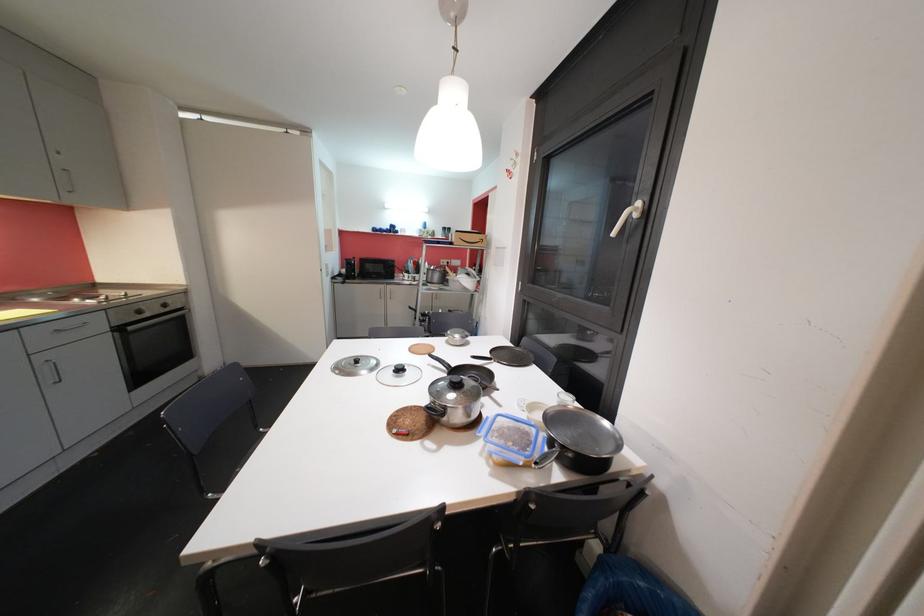
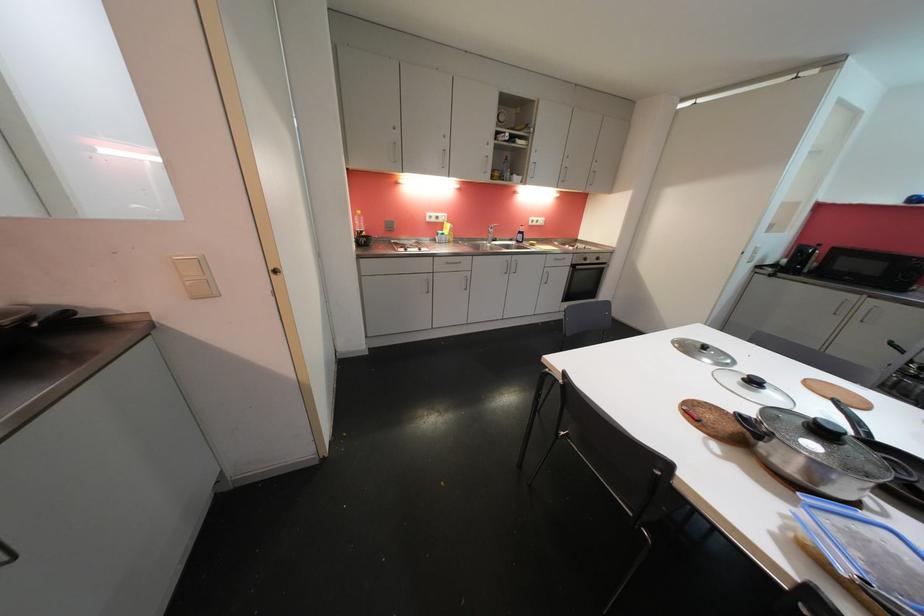
Where in the second image is the point corresponding to pixel 432 410 from the first image?

(748, 419)